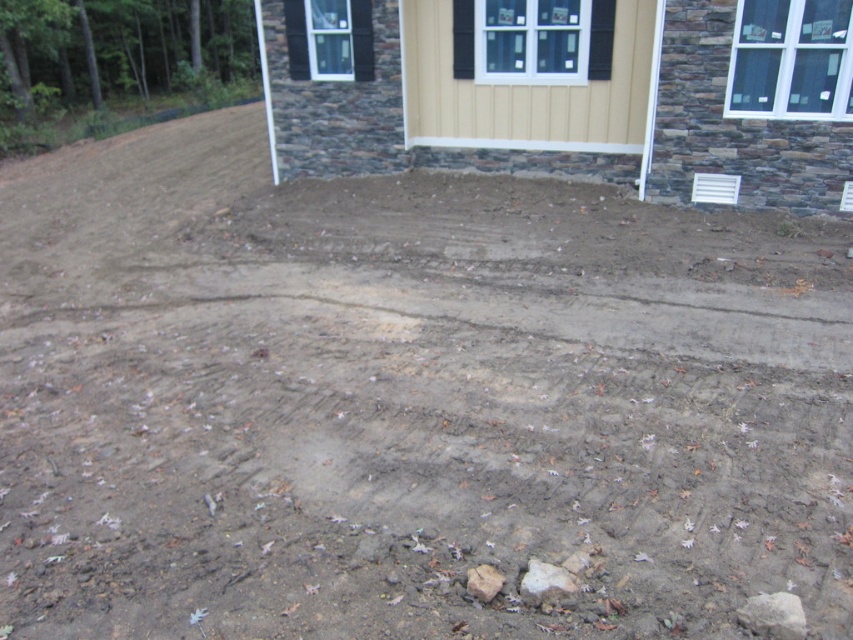
You are a construction worker who needs to choose between the gray rough rock at lower center and the gray rough stone at lower center for a project that requires a material with a larger surface area. Which one should you select?

The gray rough rock at lower center has a greater width than the gray rough stone at lower center, so it offers a larger surface area and should be selected.

You are a construction worker who needs to place a new fence post between the gray rough stone at lower right and the gray rough stone at lower center. Which stone should the post be placed closer to if the post needs to be shorter than both stones?

The gray rough stone at lower center is shorter than the gray rough stone at lower right. Therefore, the fence post should be placed closer to the gray rough stone at lower center to ensure it is shorter than both.